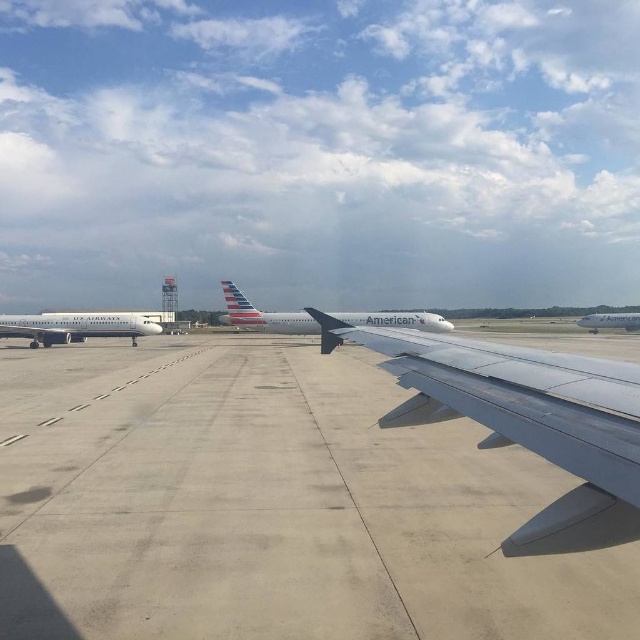
This screenshot has height=640, width=640. What do you see at coordinates (525, 420) in the screenshot?
I see `metallic gray wing at center` at bounding box center [525, 420].

Is metallic gray wing at center below white glossy airplane at center?

Yes.

Is point (538, 403) positioned before point (598, 321)?

Yes.

Identify the location of metallic gray wing at center. (525, 420).

Who is more distant from viewer, (x=573, y=544) or (x=106, y=326)?

Positioned behind is point (x=106, y=326).

Does metallic gray wing at center have a lesser height compared to silver metallic airplane at left?

Indeed, metallic gray wing at center has a lesser height compared to silver metallic airplane at left.

Locate an element on the screen. The image size is (640, 640). metallic gray wing at center is located at coordinates [525, 420].

Between gray concrete tarmac at center and silver metallic airplane at left, which one is positioned higher?

silver metallic airplane at left is above.

Who is more forward, (26, 538) or (44, 330)?

Point (26, 538)

Between point (250, 353) and point (113, 321), which one is positioned in front?

Point (250, 353) is more forward.

Find the location of `gray concrete tarmac at center`. gray concrete tarmac at center is located at coordinates [269, 504].